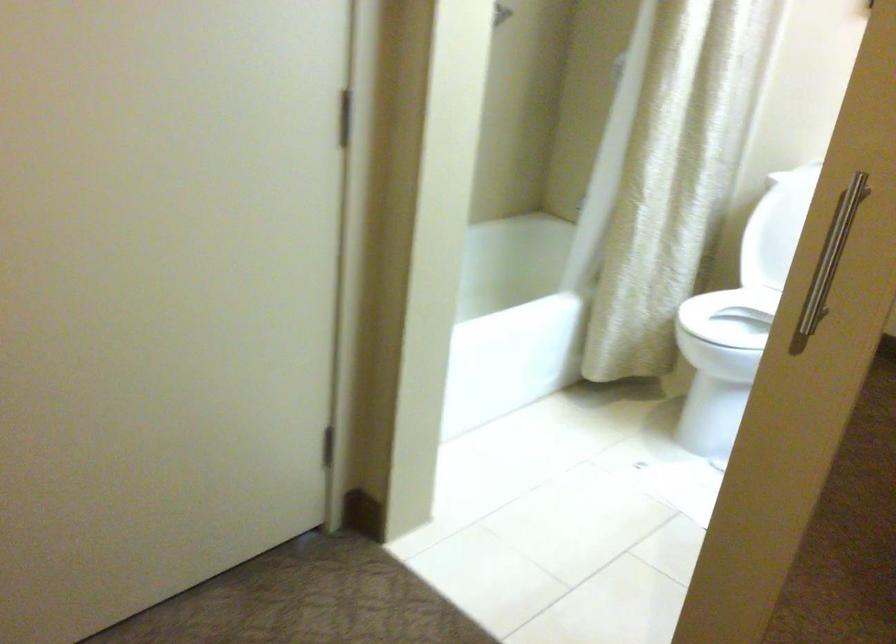
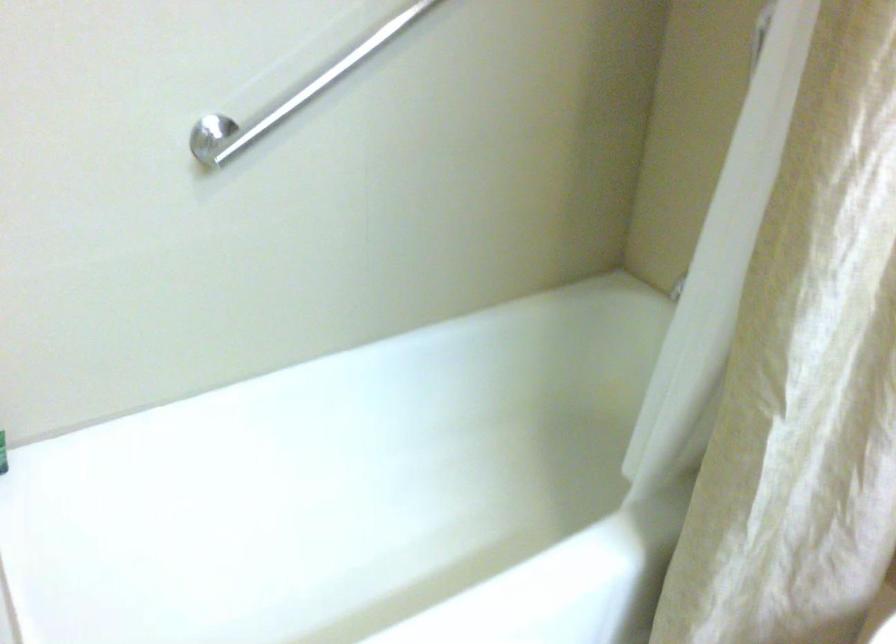
Question: Which direction would the cameraman need to move to produce the second image? Reply with the corresponding letter.

Choices:
 (A) Left
 (B) Right
 (C) Forward
 (D) Backward

Answer: (C)